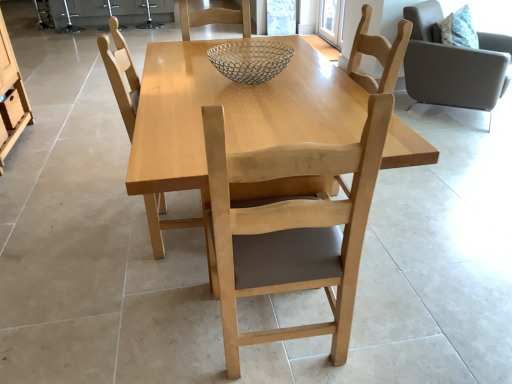
Question: From the image's perspective, is matte wood drawer at left below light wood table at center?

Choices:
 (A) yes
 (B) no

Answer: (B)

Question: Can we say matte wood drawer at left lies outside light wood table at center?

Choices:
 (A) yes
 (B) no

Answer: (A)

Question: Is matte wood drawer at left taller than light wood table at center?

Choices:
 (A) yes
 (B) no

Answer: (B)

Question: Does matte wood drawer at left appear on the left side of light wood table at center?

Choices:
 (A) yes
 (B) no

Answer: (A)

Question: From the image's perspective, is matte wood drawer at left above light wood table at center?

Choices:
 (A) no
 (B) yes

Answer: (B)

Question: Would you say light brown wood chair at right, which is the 3th chair in front-to-back order, is to the left or to the right of light wood chair at center, arranged as the first chair when viewed from the left, in the picture?

Choices:
 (A) left
 (B) right

Answer: (B)

Question: From a real-world perspective, is light brown wood chair at right, which appears as the first chair when viewed from the back, above or below light wood chair at center, arranged as the first chair when viewed from the left?

Choices:
 (A) above
 (B) below

Answer: (B)

Question: From the image's perspective, relative to light wood chair at center, the 2th chair positioned from the back, is light brown wood chair at right, which appears as the first chair when viewed from the back, above or below?

Choices:
 (A) above
 (B) below

Answer: (A)

Question: Is point (432, 67) positioned closer to the camera than point (153, 230)?

Choices:
 (A) closer
 (B) farther

Answer: (B)

Question: In the image, is light wood chair at center, the 2th chair when ordered from left to right, positioned in front of or behind light wood chair at center, which is counted as the second chair, starting from the front?

Choices:
 (A) front
 (B) behind

Answer: (A)

Question: Is point (x=218, y=153) positioned closer to the camera than point (x=138, y=89)?

Choices:
 (A) farther
 (B) closer

Answer: (B)

Question: Is light wood chair at center, which is the 1th chair in front-to-back order, taller or shorter than light wood chair at center, which is counted as the second chair, starting from the front?

Choices:
 (A) short
 (B) tall

Answer: (A)

Question: From a real-world perspective, is light wood chair at center, placed as the 3th chair when sorted from back to front, physically located above or below light wood chair at center, placed as the third chair when sorted from right to left?

Choices:
 (A) below
 (B) above

Answer: (A)

Question: Based on their positions, is metallic wire mesh bowl at center located to the left or right of light brown wood chair at right, which is the first chair in right-to-left order?

Choices:
 (A) right
 (B) left

Answer: (B)

Question: Relative to light brown wood chair at right, placed as the 3th chair when sorted from left to right, is metallic wire mesh bowl at center in front or behind?

Choices:
 (A) front
 (B) behind

Answer: (A)